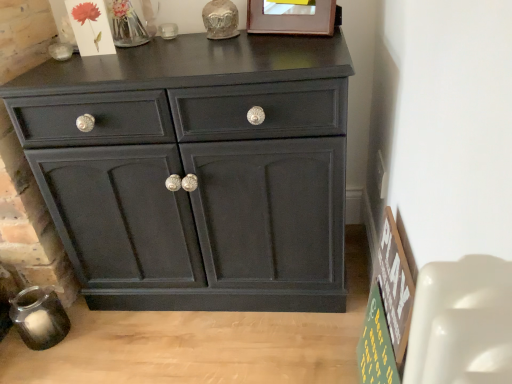
Question: Is matte black cabinet at center situated inside wooden picture frame at upper center or outside?

Choices:
 (A) outside
 (B) inside

Answer: (A)

Question: Considering their positions, is matte black cabinet at center located in front of or behind wooden picture frame at upper center?

Choices:
 (A) front
 (B) behind

Answer: (A)

Question: Which object is positioned farthest from the wooden picture frame at upper center?

Choices:
 (A) matte black cabinet at center
 (B) green wooden signboard at lower right

Answer: (B)

Question: Based on their relative distances, which object is nearer to the wooden picture frame at upper center?

Choices:
 (A) green wooden signboard at lower right
 (B) matte black cabinet at center

Answer: (B)